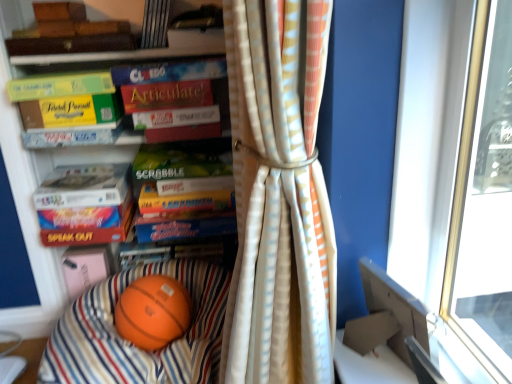
Question: Is green matte book at upper left, which appears as the 3th paperback book when viewed from the top, with matte white paperback book at center, arranged as the 6th paperback book when ordered from the bottom?

Choices:
 (A) yes
 (B) no

Answer: (B)

Question: Considering the relative sizes of green matte book at upper left, which appears as the 3th paperback book when viewed from the top, and matte white paperback book at center, arranged as the 6th paperback book when ordered from the bottom, in the image provided, is green matte book at upper left, which appears as the 3th paperback book when viewed from the top, wider than matte white paperback book at center, arranged as the 6th paperback book when ordered from the bottom,?

Choices:
 (A) no
 (B) yes

Answer: (B)

Question: Is green matte book at upper left, which appears as the 3th paperback book when viewed from the top, thinner than matte white paperback book at center, arranged as the 6th paperback book when ordered from the bottom?

Choices:
 (A) yes
 (B) no

Answer: (B)

Question: Is green matte book at upper left, placed as the 10th paperback book when sorted from bottom to top, positioned far away from matte white paperback book at center, arranged as the 6th paperback book when ordered from the bottom?

Choices:
 (A) yes
 (B) no

Answer: (B)

Question: Could you tell me if green matte book at upper left, placed as the 10th paperback book when sorted from bottom to top, is facing matte white paperback book at center, which is counted as the seventh paperback book, starting from the top?

Choices:
 (A) no
 (B) yes

Answer: (A)

Question: From the image's perspective, relative to matte white paperback book at center, the 10th paperback book from the top, is matte green paperback book at left, which is counted as the 8th paperback book, starting from the top, above or below?

Choices:
 (A) above
 (B) below

Answer: (A)

Question: Considering their positions, is matte green paperback book at left, placed as the 5th paperback book when sorted from bottom to top, located in front of or behind matte white paperback book at center, the 10th paperback book from the top?

Choices:
 (A) front
 (B) behind

Answer: (A)

Question: In terms of width, does matte green paperback book at left, which is counted as the 8th paperback book, starting from the top, look wider or thinner when compared to matte white paperback book at center, the 10th paperback book from the top?

Choices:
 (A) wide
 (B) thin

Answer: (B)

Question: Is matte green paperback book at left, which is counted as the 8th paperback book, starting from the top, inside or outside of matte white paperback book at center, the 10th paperback book from the top?

Choices:
 (A) inside
 (B) outside

Answer: (B)

Question: Considering the positions of point (64, 307) and point (162, 34), is point (64, 307) closer or farther from the camera than point (162, 34)?

Choices:
 (A) closer
 (B) farther

Answer: (B)

Question: Is orange matte basketball at lower center wider or thinner than hardcover book at upper center, the first book viewed from the top?

Choices:
 (A) wide
 (B) thin

Answer: (A)

Question: Considering the positions of orange matte basketball at lower center and hardcover book at upper center, the second book positioned from the back, in the image, is orange matte basketball at lower center bigger or smaller than hardcover book at upper center, the second book positioned from the back,?

Choices:
 (A) big
 (B) small

Answer: (A)

Question: From a real-world perspective, is orange matte basketball at lower center above or below hardcover book at upper center, which is the 3th book in bottom-to-top order?

Choices:
 (A) below
 (B) above

Answer: (A)

Question: Relative to matte green paperback book at left, which is counted as the 8th paperback book, starting from the top, is green matte scrabble board game at center, marked as the ninth paperback book in a top-to-bottom arrangement, in front or behind?

Choices:
 (A) behind
 (B) front

Answer: (A)

Question: Is green matte scrabble board game at center, marked as the ninth paperback book in a top-to-bottom arrangement, inside the boundaries of matte green paperback book at left, which is counted as the 8th paperback book, starting from the top, or outside?

Choices:
 (A) outside
 (B) inside

Answer: (A)